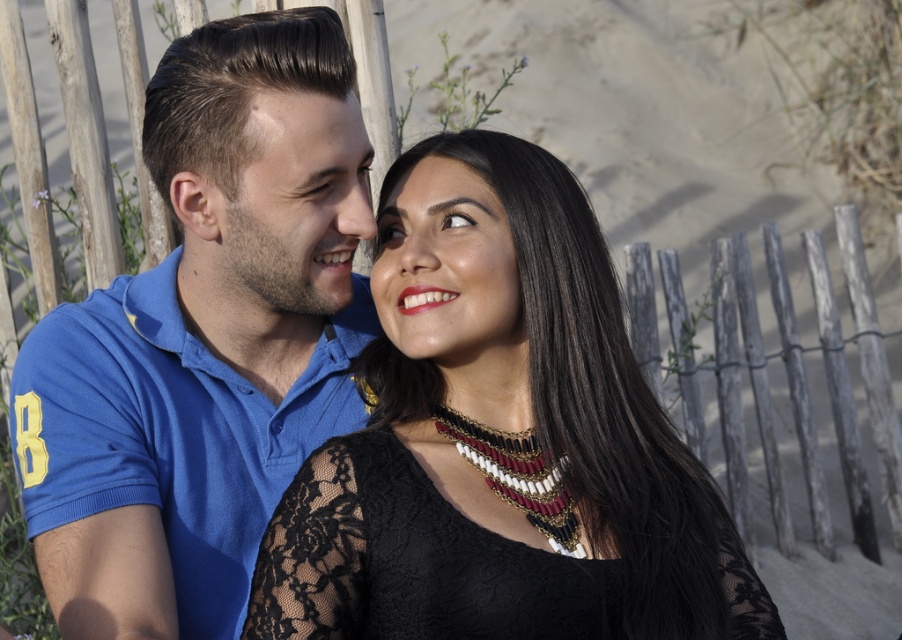
You are a photographer adjusting your camera settings. You want to focus on the black lace dress at center and the smooth skin at upper center. Which object should you adjust your focus to first to ensure it appears sharp in the photo?

The black lace dress at center is closer to the viewer than the smooth skin at upper center. Therefore, you should focus on the black lace dress at center first since it is nearer and will require proper focus adjustment before the background elements like the smooth skin at upper center become sharp.